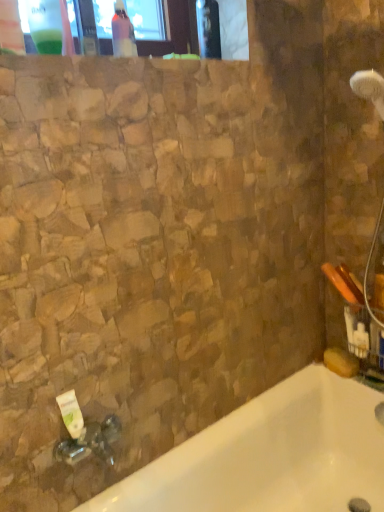
Question: Considering the relative sizes of transparent plastic bottle at upper left, the 2th bottle viewed from the back, and pink glossy bottle at upper center, the first bottle in the right-to-left sequence, in the image provided, is transparent plastic bottle at upper left, the 2th bottle viewed from the back, wider than pink glossy bottle at upper center, the first bottle in the right-to-left sequence,?

Choices:
 (A) yes
 (B) no

Answer: (A)

Question: From the image's perspective, is transparent plastic bottle at upper left, the 2th bottle viewed from the back, beneath pink glossy bottle at upper center, which is the first bottle from back to front?

Choices:
 (A) yes
 (B) no

Answer: (A)

Question: Is transparent plastic bottle at upper left, the first bottle positioned from the front, in contact with pink glossy bottle at upper center, which is the 2th bottle from front to back?

Choices:
 (A) yes
 (B) no

Answer: (B)

Question: Is transparent plastic bottle at upper left, the 2th bottle viewed from the back, taller than pink glossy bottle at upper center, the first bottle in the right-to-left sequence?

Choices:
 (A) no
 (B) yes

Answer: (B)

Question: Is transparent plastic bottle at upper left, which is the first bottle in left-to-right order, to the right of pink glossy bottle at upper center, which is the 2th bottle from front to back, from the viewer's perspective?

Choices:
 (A) no
 (B) yes

Answer: (A)

Question: From the image's perspective, relative to transparent plastic bottle at upper left, the first bottle positioned from the front, is white glossy bathtub at lower left above or below?

Choices:
 (A) above
 (B) below

Answer: (B)

Question: From a real-world perspective, is white glossy bathtub at lower left positioned above or below transparent plastic bottle at upper left, which is the first bottle in left-to-right order?

Choices:
 (A) above
 (B) below

Answer: (B)

Question: Considering the positions of white glossy bathtub at lower left and transparent plastic bottle at upper left, which is the first bottle in left-to-right order, in the image, is white glossy bathtub at lower left taller or shorter than transparent plastic bottle at upper left, which is the first bottle in left-to-right order,?

Choices:
 (A) tall
 (B) short

Answer: (A)

Question: In terms of width, does white glossy bathtub at lower left look wider or thinner when compared to transparent plastic bottle at upper left, the 2th bottle viewed from the back?

Choices:
 (A) wide
 (B) thin

Answer: (A)

Question: Considering the positions of transparent plastic bottle at upper left, arranged as the 2th bottle when viewed from the right, and pink glossy bottle at upper center, the first bottle in the right-to-left sequence, in the image, is transparent plastic bottle at upper left, arranged as the 2th bottle when viewed from the right, wider or thinner than pink glossy bottle at upper center, the first bottle in the right-to-left sequence,?

Choices:
 (A) thin
 (B) wide

Answer: (B)

Question: From a real-world perspective, is transparent plastic bottle at upper left, arranged as the 2th bottle when viewed from the right, positioned above or below pink glossy bottle at upper center, which is the first bottle from back to front?

Choices:
 (A) below
 (B) above

Answer: (B)

Question: From the image's perspective, is transparent plastic bottle at upper left, the first bottle positioned from the front, located above or below pink glossy bottle at upper center, the second bottle positioned from the left?

Choices:
 (A) above
 (B) below

Answer: (B)

Question: Is point (33, 13) closer or farther from the camera than point (115, 35)?

Choices:
 (A) closer
 (B) farther

Answer: (A)

Question: Is point (309, 485) closer or farther from the camera than point (66, 412)?

Choices:
 (A) closer
 (B) farther

Answer: (B)

Question: Considering the positions of white glossy bathtub at lower left and white matte tube at lower left in the image, is white glossy bathtub at lower left bigger or smaller than white matte tube at lower left?

Choices:
 (A) big
 (B) small

Answer: (A)